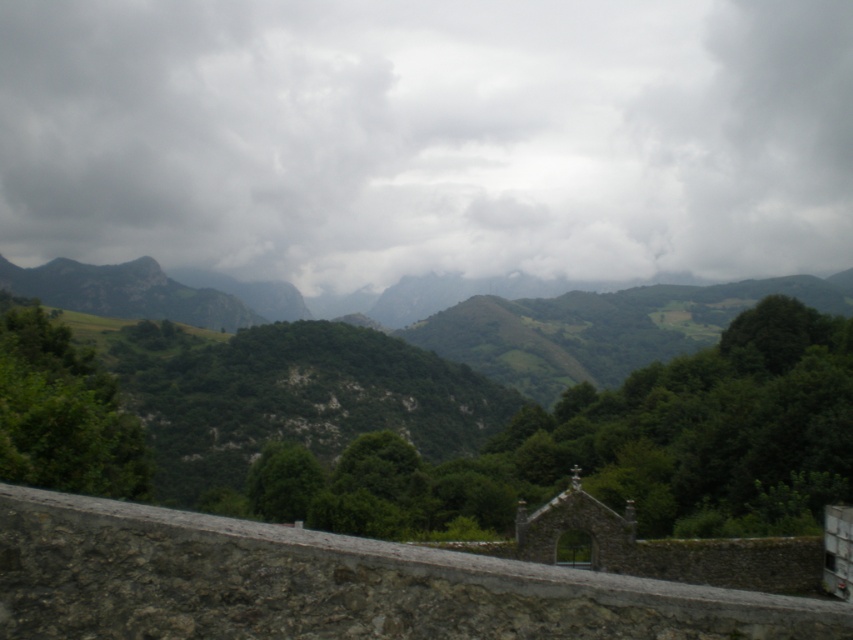
You are an architect designing a new garden path that needs to pass between the cloudy sky at upper center and the gray stone wall at lower center. Considering their relative sizes, which object should the path be designed to go around?

The cloudy sky at upper center is taller than the gray stone wall at lower center, so the path should be designed to go around the gray stone wall at lower center since it is shorter and easier to navigate around.

You are an architect designing a new garden layout. You need to decide where to place a large statue that will be visible from both the cloudy sky at upper center and the gray stone wall at lower center. Based on their sizes, which object should the statue be closer to?

The cloudy sky at upper center is bigger than the gray stone wall at lower center, so the statue should be placed closer to the cloudy sky at upper center to ensure visibility from both points.

You are standing in the landscape scene and want to determine which of the two points, point (288, 141) or point (128, 586), is closer to you. Based on the scene description, which point is nearer?

Point (288, 141) is further to the viewer than point (128, 586). Wait, no, the description says the opposite. Let me check again. The Objects Description states that point (288, 141) is further to the viewer than point (128, 586). So the answer should be that point (288, 141) is further away, meaning point (128, 586) is closer to the viewer. Hmm, but the user wants to know which is closer. So the answer is point (128, 586) is closer because the other is further away.